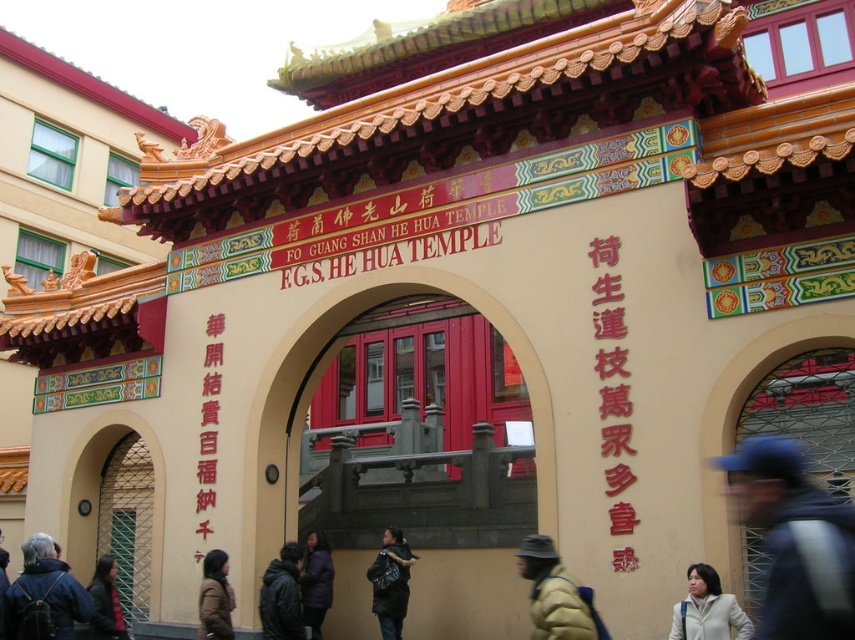
You are standing at the entrance of the Fo Guang Shan He Hua Temple and want to know if you can comfortably walk between the yellow down jacket at lower center and the brown fuzzy coat at lower left. Can you do so?

The yellow down jacket at lower center is 45.54 feet from the brown fuzzy coat at lower left, so yes, you can comfortably walk between them as the distance is more than sufficient for a person to pass through.

You are standing at the entrance of the Fo Guang Shan He Hua Temple and want to read the red glossy text at center right. You are currently holding a black jacket at lower center. If you walk straight ahead, will you be able to see the text clearly from your current position?

The red glossy text at center right is 47.96 feet away from the black jacket at lower center. Since 47.96 feet is a considerable distance, you may need to move closer to read the text clearly.

Consider the image. You are a visitor at the temple entrance and notice two jackets hanging on the rack. The black jacket at lower center and the dark gray jacket at center. Which jacket is bigger?

The black jacket at lower center is larger in size than the dark gray jacket at center.